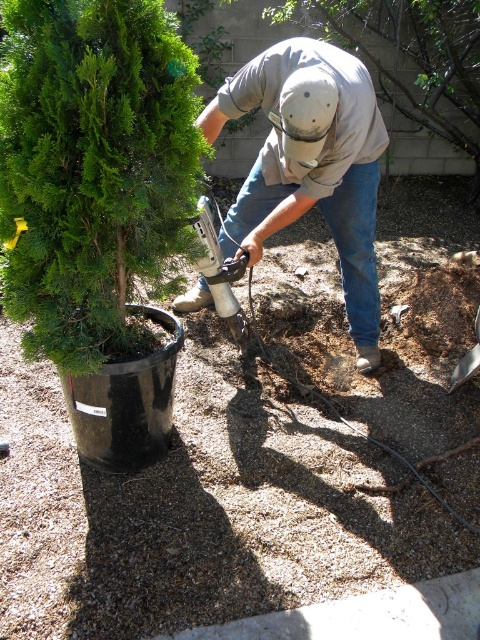
You are a landscaper who needs to place a new decorative rock garden between the green matte shrub at left and the potted evergreen tree. Given that the rocks require a minimum of 6 feet of space to be properly arranged, will there be enough space between them?

The green matte shrub at left and the potted evergreen tree are 5.39 feet apart, which is less than the required 6 feet. Therefore, there is not enough space to place the decorative rock garden between them.

You are a safety inspector observing the landscaping work. You notice the gray fabric shirt at center and the green matte tree at center. According to safety protocols, workers must maintain a minimum distance of 2 meters from any trees when operating power tools. Is the worker complying with this rule?

The gray fabric shirt at center is in front of the green matte tree at center, which means the worker is too close to the tree, violating the safety protocol requiring a minimum distance of 2 meters.

You are a landscape architect observing the scene. You need to determine which object is taller between the gray fabric shirt at center and the green matte tree at center. Based on the scene description, which one is taller?

The green matte tree at center is taller than the gray fabric shirt at center.